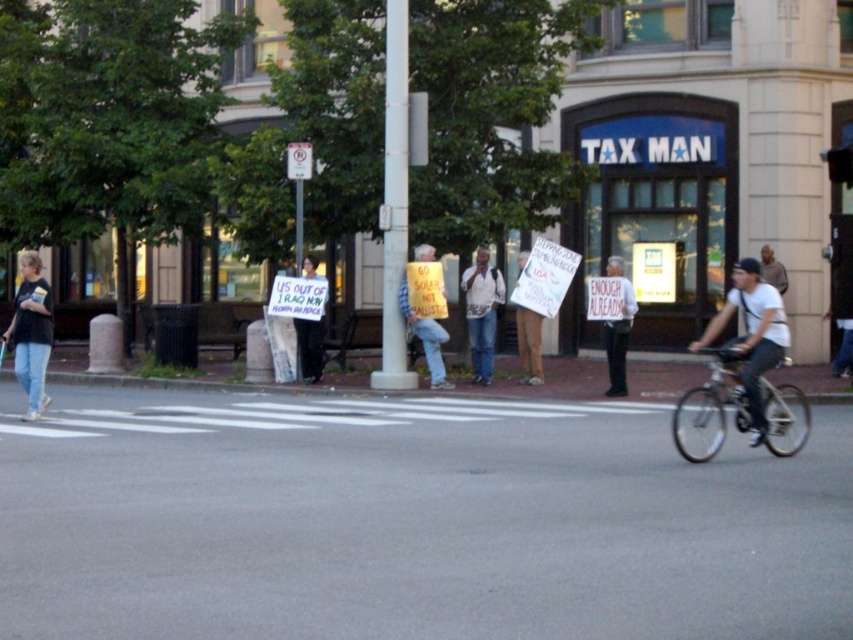
Who is positioned more to the left, silver metallic bicycle at right or yellow paper sign at center?

Positioned to the left is yellow paper sign at center.

Is silver metallic bicycle at right smaller than yellow paper sign at center?

Yes.

Is point (693, 458) positioned behind point (403, 312)?

No, (693, 458) is closer to viewer.

What are the coordinates of `silver metallic bicycle at right` in the screenshot? It's located at (711, 408).

Looking at this image, is silver metallic bicycle at right wider than dark gray bicycle at center right?

In fact, silver metallic bicycle at right might be narrower than dark gray bicycle at center right.

Is point (737, 356) positioned in front of point (753, 300)?

Yes, it is in front of point (753, 300).

You are a GUI agent. You are given a task and a screenshot of the screen. Output one action in this format:
    pyautogui.click(x=<x>, y=<y>)
    Task: Click on the silver metallic bicycle at right
    This screenshot has height=640, width=853.
    Given the screenshot: What is the action you would take?
    pyautogui.click(x=711, y=408)

The width and height of the screenshot is (853, 640). Find the location of `silver metallic bicycle at right`. silver metallic bicycle at right is located at coordinates (711, 408).

You are a GUI agent. You are given a task and a screenshot of the screen. Output one action in this format:
    pyautogui.click(x=<x>, y=<y>)
    Task: Click on the yellow paper sign at center
    This screenshot has height=640, width=853.
    Given the screenshot: What is the action you would take?
    pyautogui.click(x=425, y=337)

Is yellow paper sign at center positioned at the back of white paper sign at center?

Yes, yellow paper sign at center is further from the viewer.

Is point (439, 333) less distant than point (627, 326)?

No.

Image resolution: width=853 pixels, height=640 pixels. I want to click on yellow paper sign at center, so click(x=425, y=337).